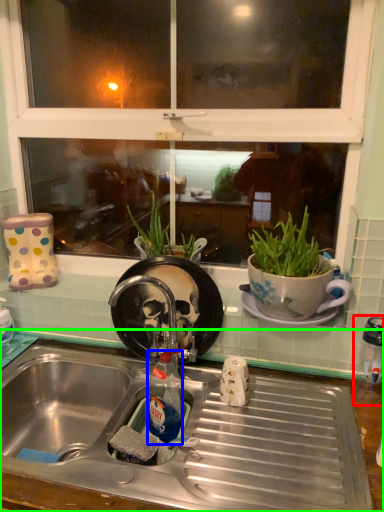
Question: Considering the real-world distances, which object is closest to appliance (highlighted by a red box)? bottle (highlighted by a blue box) or desk (highlighted by a green box).

Choices:
 (A) bottle
 (B) desk

Answer: (B)